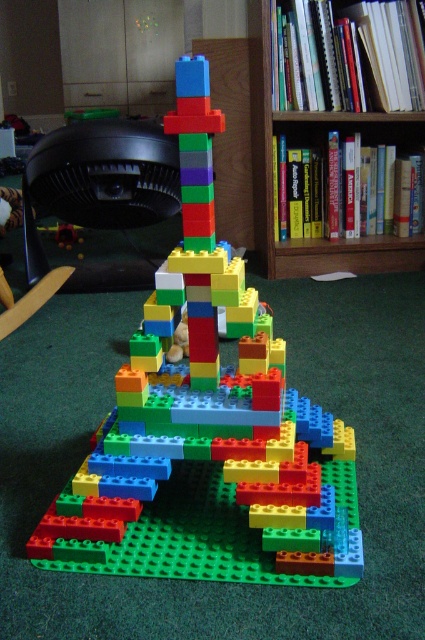
Question: Is multicolored plastic blocks at center above wooden bookshelf at upper center?

Choices:
 (A) no
 (B) yes

Answer: (A)

Question: Does multicolored plastic blocks at center appear on the right side of wooden bookshelf at upper center?

Choices:
 (A) yes
 (B) no

Answer: (B)

Question: Can you confirm if multicolored plastic blocks at center is wider than wooden bookshelf at upper center?

Choices:
 (A) yes
 (B) no

Answer: (B)